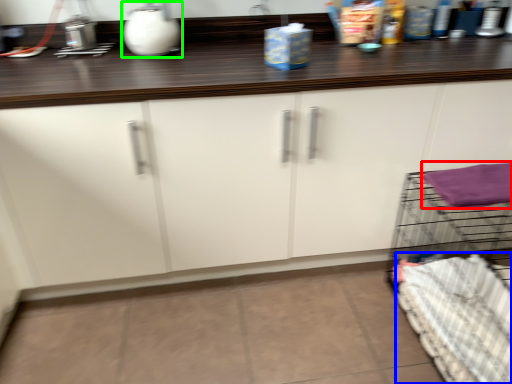
Question: Which object is positioned farthest from bath towel (highlighted by a red box)? Select from bedding (highlighted by a blue box) and appliance (highlighted by a green box).

Choices:
 (A) bedding
 (B) appliance

Answer: (B)